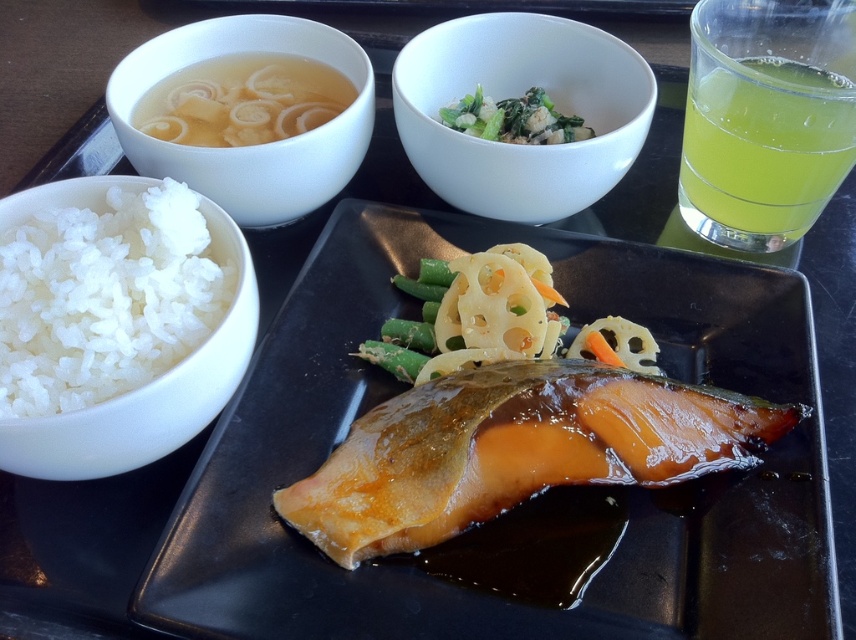
You are a food delivery person who needs to pick up the translucent broth with noodles at upper left and the green leafy vegetables at upper center. Can you grab them both without moving the main dish? Explain your plan.

The translucent broth with noodles at upper left is in front of the green leafy vegetables at upper center. Since the broth is in front, you can first reach for the green leafy vegetables at upper center by moving your hand behind the broth. Then, you can grasp the translucent broth with noodles at upper left directly. This way, you can pick up both items without disturbing the main dish.

You are a food delivery person who needs to place a hot pad between the glossy ceramic platter at lower left and the white matte rice bowl at left to prevent the tray from getting too hot. The hot pad is 20 centimeters wide. Will the hot pad fit between them?

The glossy ceramic platter at lower left and white matte rice bowl at left are 19.65 centimeters apart from each other. Since the hot pad is 20 centimeters wide, it will not fit between them as the distance is slightly less than the required space.

You are a food delivery person who needs to deliver this meal without spilling any soup. The soup is in the bowl located at the point with coordinates (762,152). What should you do to ensure the soup stays in place during delivery?

The point (762,152) indicates the translucent yellow liquid at upper right, so you should hold the tray carefully and avoid sudden movements to prevent the soup from spilling.